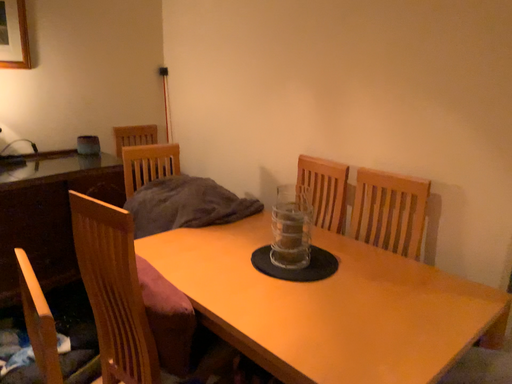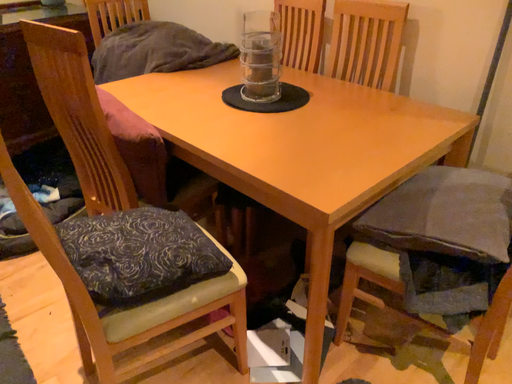
Question: How did the camera likely rotate when shooting the video?

Choices:
 (A) rotated downward
 (B) rotated upward

Answer: (A)